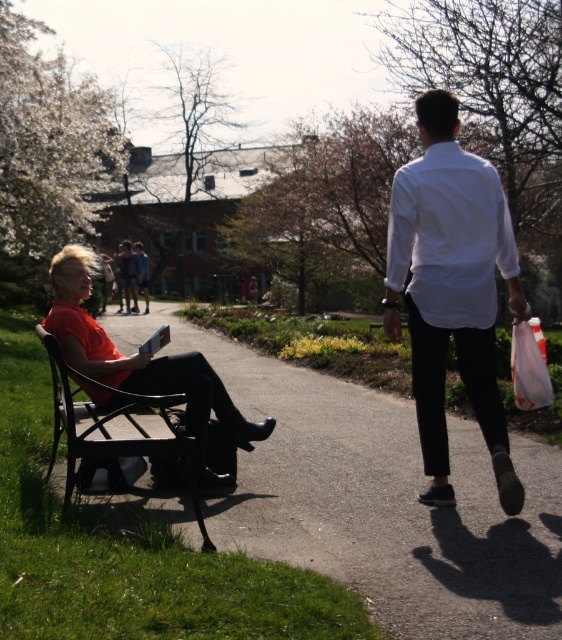
Question: Does matte orange shirt at left have a greater width compared to black metal bench at left?

Choices:
 (A) yes
 (B) no

Answer: (B)

Question: Which object appears farthest from the camera in this image?

Choices:
 (A) white smooth shirt at right
 (B) black metal bench at left
 (C) matte orange shirt at left
 (D) wooden bench at left

Answer: (C)

Question: Does matte orange shirt at left lie behind black metal bench at left?

Choices:
 (A) yes
 (B) no

Answer: (A)

Question: Can you confirm if wooden bench at left is positioned above white smooth shirt at right?

Choices:
 (A) yes
 (B) no

Answer: (B)

Question: Which of these objects is positioned farthest from the wooden bench at left?

Choices:
 (A) black metal bench at left
 (B) white smooth shirt at right

Answer: (B)

Question: Which point is farther from the camera taking this photo?

Choices:
 (A) (464, 342)
 (B) (161, 385)

Answer: (B)